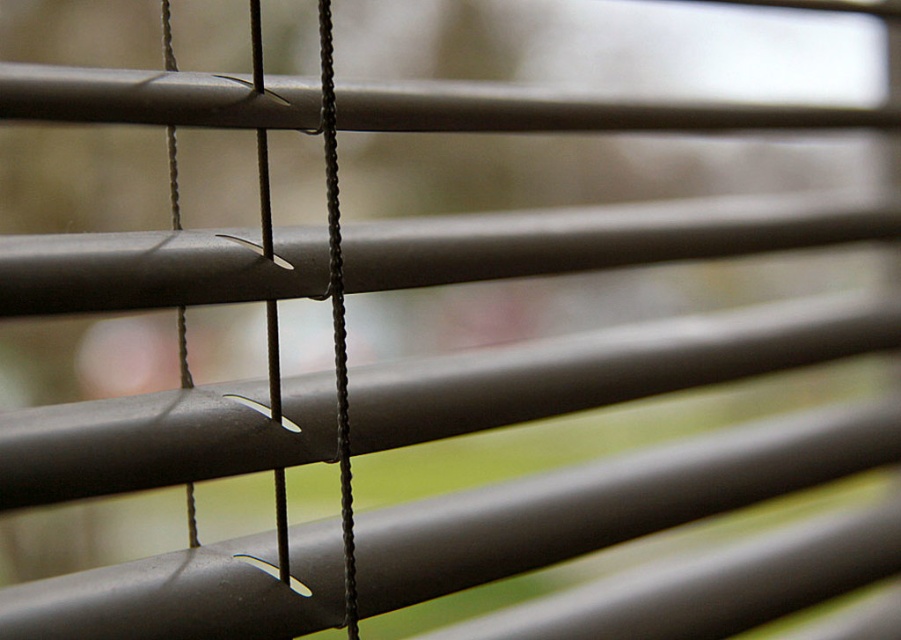
You are standing in front of the window with horizontal blinds and notice a black matte string at center. Where exactly is the black matte string located in terms of coordinates?

The black matte string at center is located at coordinates point (264, 195).

You are trying to adjust the window blinds and notice two controls. One is the black cord at center and the other is the black matte string at left. Which control is longer in height?

The black cord at center is much taller than the black matte string at left, so the black cord at center is the longer one in height.